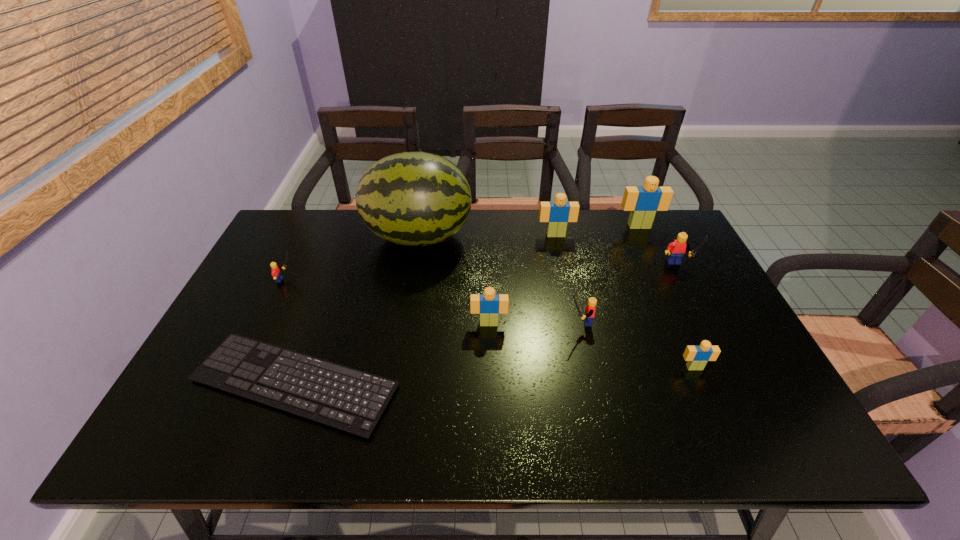
You are a GUI agent. You are given a task and a screenshot of the screen. Output one action in this format:
    pyautogui.click(x=<x>, y=<y>)
    Task: Click on the vacant point located between the smallest yellow Lego and the nearest yellow Lego
    
    Given the screenshot: What is the action you would take?
    pyautogui.click(x=432, y=301)

Locate an element on the screen. This screenshot has height=540, width=960. free space between the green watermelon and the eighth shortest object is located at coordinates (529, 232).

This screenshot has height=540, width=960. What are the coordinates of `free space that is in between the nearest Lego and the black computer keyboard` in the screenshot? It's located at (494, 375).

You are a GUI agent. You are given a task and a screenshot of the screen. Output one action in this format:
    pyautogui.click(x=<x>, y=<y>)
    Task: Click on the empty location between the rightmost yellow Lego and the nearest yellow Lego
    
    Given the screenshot: What is the action you would take?
    pyautogui.click(x=628, y=295)

Identify the location of vacant region between the second tallest object and the nearest beige Lego. This screenshot has width=960, height=540. (666, 297).

Where is `vacant space that is in between the leftmost Lego and the watermelon`? The image size is (960, 540). vacant space that is in between the leftmost Lego and the watermelon is located at coordinates (352, 258).

The height and width of the screenshot is (540, 960). Find the location of `vacant area that lies between the farthest Lego and the biggest yellow Lego`. vacant area that lies between the farthest Lego and the biggest yellow Lego is located at coordinates (658, 247).

At what (x,y) coordinates should I click in order to perform the action: click on blank region between the second tallest object and the nearest Lego. Please return your answer as a coordinate pair (x, y). Looking at the image, I should click on (666, 297).

Find the location of a particular element. Image resolution: width=960 pixels, height=540 pixels. unoccupied position between the tallest Lego and the biggest yellow Lego is located at coordinates (658, 247).

Where is `empty space that is in between the shortest object and the nearest yellow Lego`? The width and height of the screenshot is (960, 540). empty space that is in between the shortest object and the nearest yellow Lego is located at coordinates pyautogui.click(x=437, y=353).